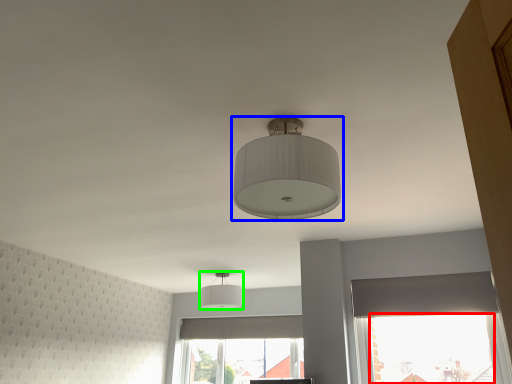
Question: Based on their relative distances, which object is nearer to window screen (highlighted by a red box)? Choose from lamp (highlighted by a blue box) and lamp (highlighted by a green box).

Choices:
 (A) lamp
 (B) lamp

Answer: (B)